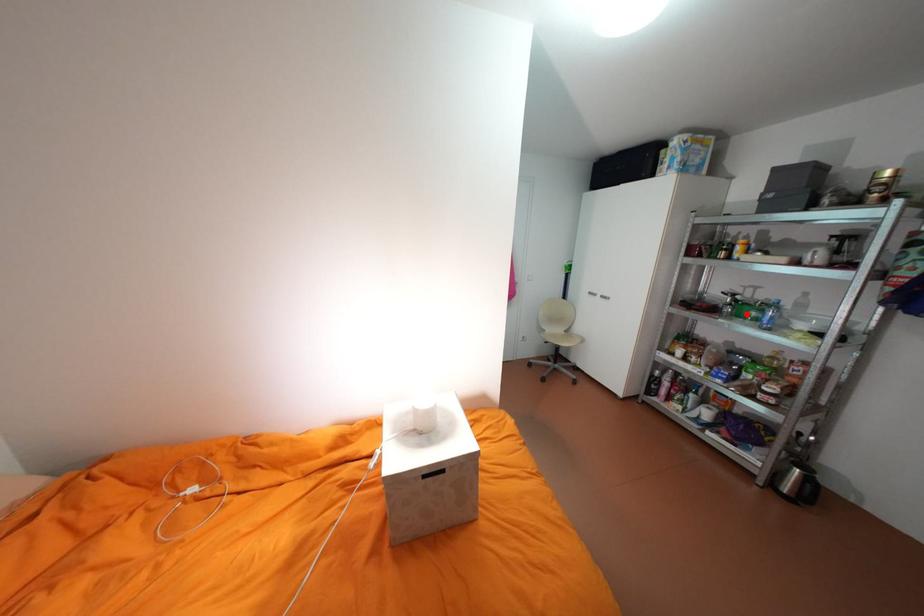
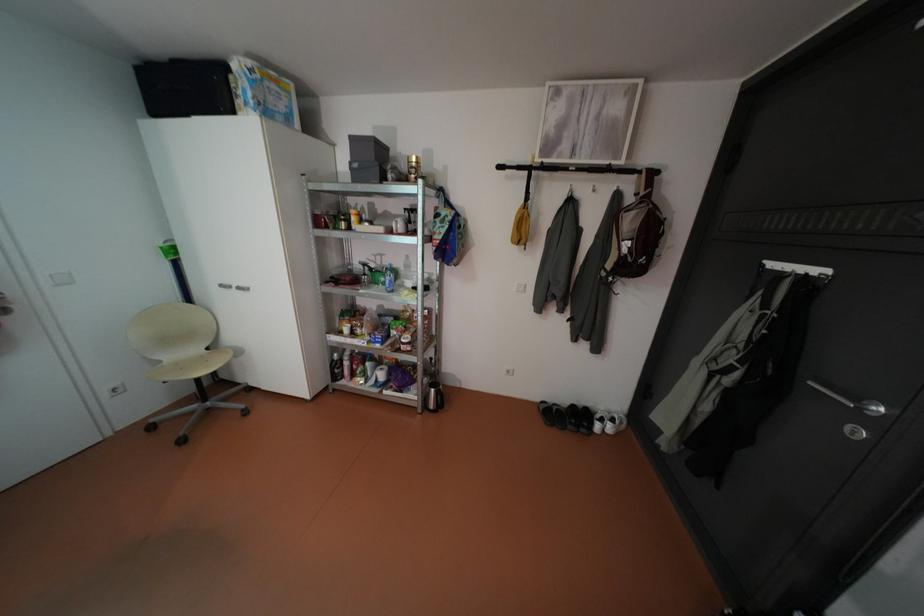
Find the pixel in the second image that matches the highlighted location in the first image.

(383, 282)